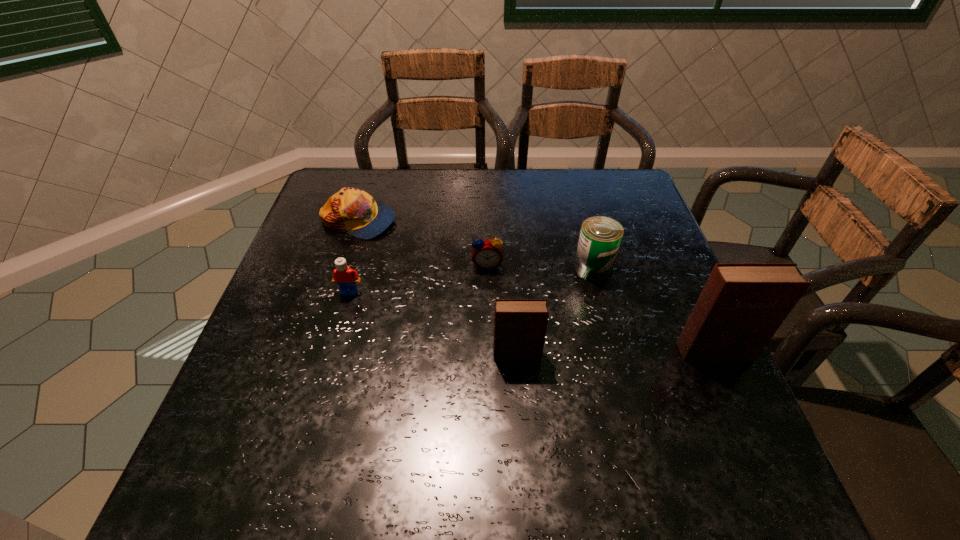
This screenshot has width=960, height=540. I want to click on free region located 0.050m on the front cover of the fifth shortest object, so pos(518,383).

Identify the location of free spot located on the face of the third nearest object. This screenshot has height=540, width=960. (335, 342).

You are a GUI agent. You are given a task and a screenshot of the screen. Output one action in this format:
    pyautogui.click(x=<x>, y=<y>)
    Task: Click on the vacant area located 0.350m on the front-facing side of the alarm clock
    
    Given the screenshot: What is the action you would take?
    pyautogui.click(x=490, y=402)

What are the coordinates of `blank area located 0.050m on the bill of the cap` in the screenshot? It's located at (414, 221).

Locate an element on the screen. The image size is (960, 540). free point located 0.380m on the back of the fifth object from left to right is located at coordinates (568, 174).

Identify the location of object at the far edge. (354, 211).

Find the location of a particular element. Image resolution: width=960 pixels, height=540 pixels. Lego located in the left edge section of the desktop is located at coordinates (343, 275).

I want to click on cap situated at the left edge, so click(354, 211).

The width and height of the screenshot is (960, 540). Identify the location of diary located in the right edge section of the desktop. (742, 305).

At what (x,y) coordinates should I click in order to perform the action: click on can located at the right edge. Please return your answer as a coordinate pair (x, y). This screenshot has height=540, width=960. Looking at the image, I should click on (600, 237).